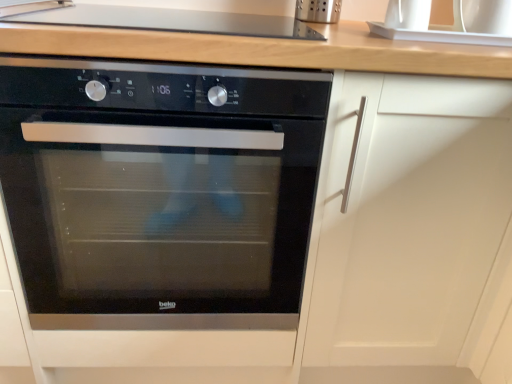
Question: Does smooth glass cooktop at upper center come behind white glossy sink at upper right?

Choices:
 (A) yes
 (B) no

Answer: (B)

Question: Is smooth glass cooktop at upper center facing towards white glossy sink at upper right?

Choices:
 (A) yes
 (B) no

Answer: (B)

Question: From a real-world perspective, is smooth glass cooktop at upper center on white glossy sink at upper right?

Choices:
 (A) no
 (B) yes

Answer: (A)

Question: Can you confirm if smooth glass cooktop at upper center is shorter than white glossy sink at upper right?

Choices:
 (A) yes
 (B) no

Answer: (B)

Question: Would you say smooth glass cooktop at upper center is a long distance from white glossy sink at upper right?

Choices:
 (A) no
 (B) yes

Answer: (A)

Question: Considering the relative positions of smooth glass cooktop at upper center and white glossy sink at upper right in the image provided, is smooth glass cooktop at upper center to the right of white glossy sink at upper right from the viewer's perspective?

Choices:
 (A) no
 (B) yes

Answer: (A)

Question: From a real-world perspective, does black glass oven at center stand above smooth glass cooktop at upper center?

Choices:
 (A) no
 (B) yes

Answer: (A)

Question: Can you confirm if black glass oven at center is bigger than smooth glass cooktop at upper center?

Choices:
 (A) no
 (B) yes

Answer: (B)

Question: From the image's perspective, does black glass oven at center appear lower than smooth glass cooktop at upper center?

Choices:
 (A) no
 (B) yes

Answer: (B)

Question: Is black glass oven at center aimed at smooth glass cooktop at upper center?

Choices:
 (A) yes
 (B) no

Answer: (B)

Question: Is black glass oven at center thinner than smooth glass cooktop at upper center?

Choices:
 (A) yes
 (B) no

Answer: (B)

Question: From a real-world perspective, is black glass oven at center physically below smooth glass cooktop at upper center?

Choices:
 (A) no
 (B) yes

Answer: (B)

Question: Is black glass oven at center oriented towards white glossy sink at upper right?

Choices:
 (A) yes
 (B) no

Answer: (B)